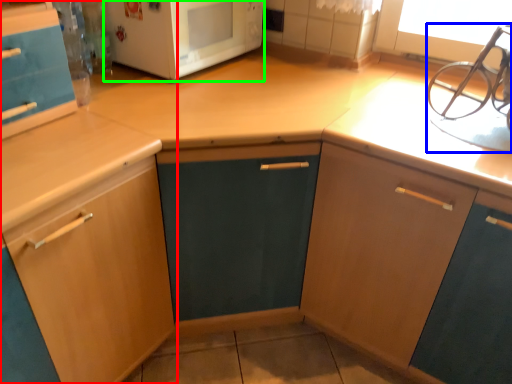
Question: Based on their relative distances, which object is nearer to cabinetry (highlighted by a red box)? Choose from sink (highlighted by a blue box) and microwave oven (highlighted by a green box).

Choices:
 (A) sink
 (B) microwave oven

Answer: (B)